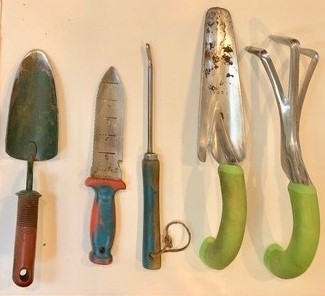
The height and width of the screenshot is (296, 325). What are the coordinates of `handle` in the screenshot? It's located at (156, 230).